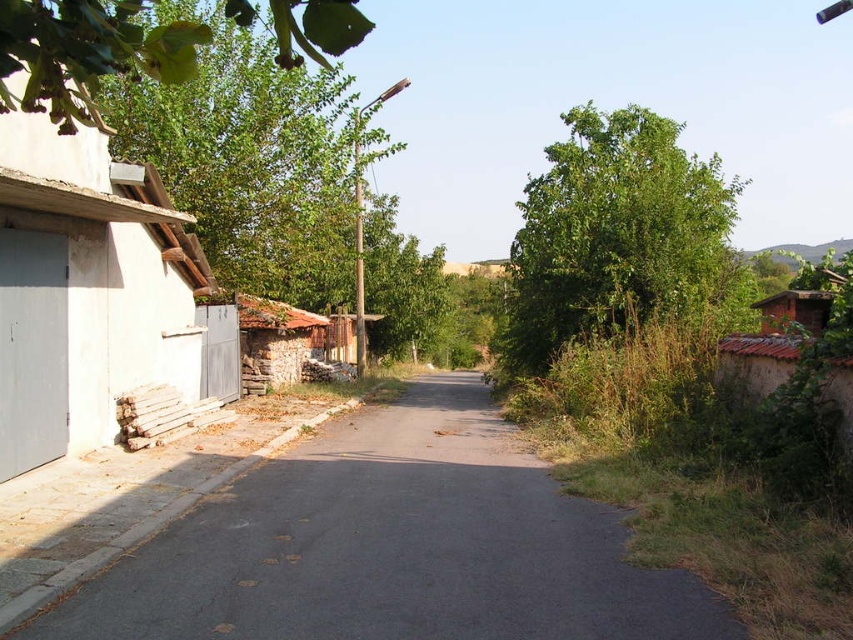
Question: Considering the relative positions of green leafy tree at upper left and rustic stone hut at center-left in the image provided, where is green leafy tree at upper left located with respect to rustic stone hut at center-left?

Choices:
 (A) right
 (B) left

Answer: (A)

Question: Which point is farther to the camera?

Choices:
 (A) (260, 557)
 (B) (180, 387)
 (C) (122, 61)

Answer: (B)

Question: Which object is closer to the camera taking this photo?

Choices:
 (A) white concrete hut at left
 (B) green leafy tree at right

Answer: (A)

Question: Which point is closer to the camera taking this photo?

Choices:
 (A) (660, 209)
 (B) (393, 504)

Answer: (B)

Question: Can you confirm if asphalt at center is positioned to the left of white concrete hut at left?

Choices:
 (A) no
 (B) yes

Answer: (A)

Question: Does green leafy tree at right appear on the right side of green leafy tree at upper left?

Choices:
 (A) yes
 (B) no

Answer: (A)